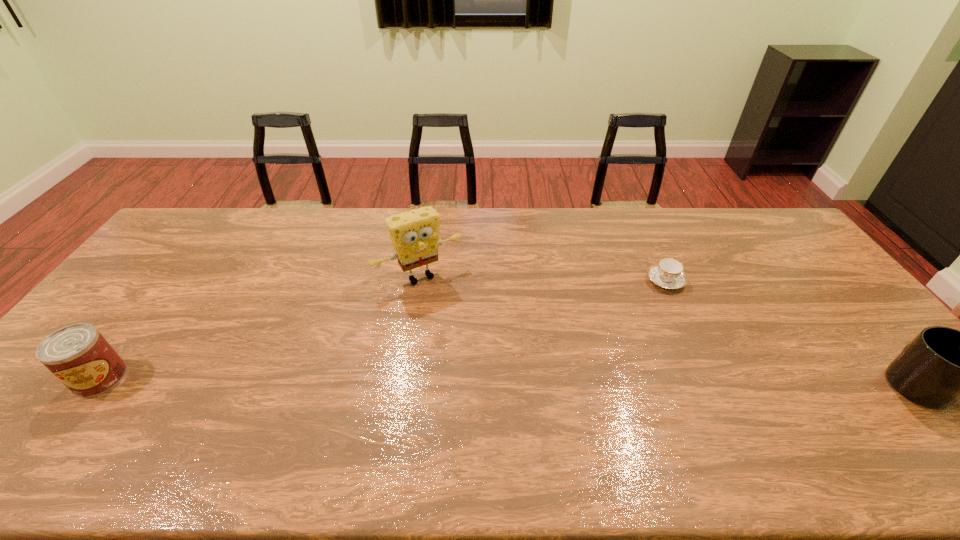
Find the location of a particular element. The width and height of the screenshot is (960, 540). free space on the desktop that is between the can and the mug and is positioned on the side with the handle of the third object from left to right is located at coordinates (542, 382).

Locate an element on the screen. This screenshot has width=960, height=540. free space on the desktop that is between the leftmost object and the mug and is positioned on the face of the second object from left to right is located at coordinates (489, 382).